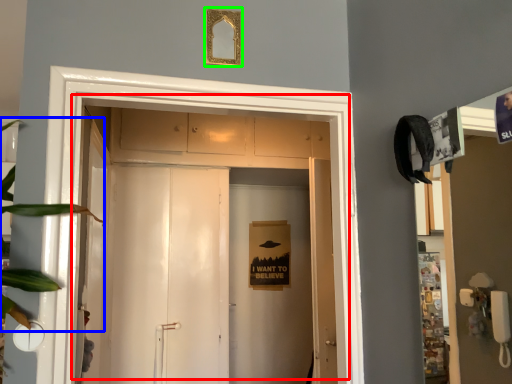
Question: Considering the real-world distances, which object is farthest from door (highlighted by a red box)? plant (highlighted by a blue box) or picture frame (highlighted by a green box)?

Choices:
 (A) plant
 (B) picture frame

Answer: (A)